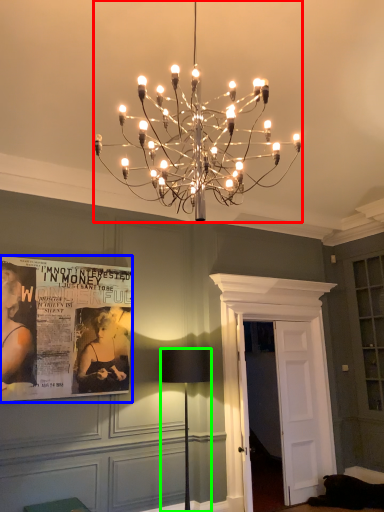
Question: Which object is the farthest from lamp (highlighted by a red box)? Choose among these: poster page (highlighted by a blue box) or lamp (highlighted by a green box).

Choices:
 (A) poster page
 (B) lamp

Answer: (B)